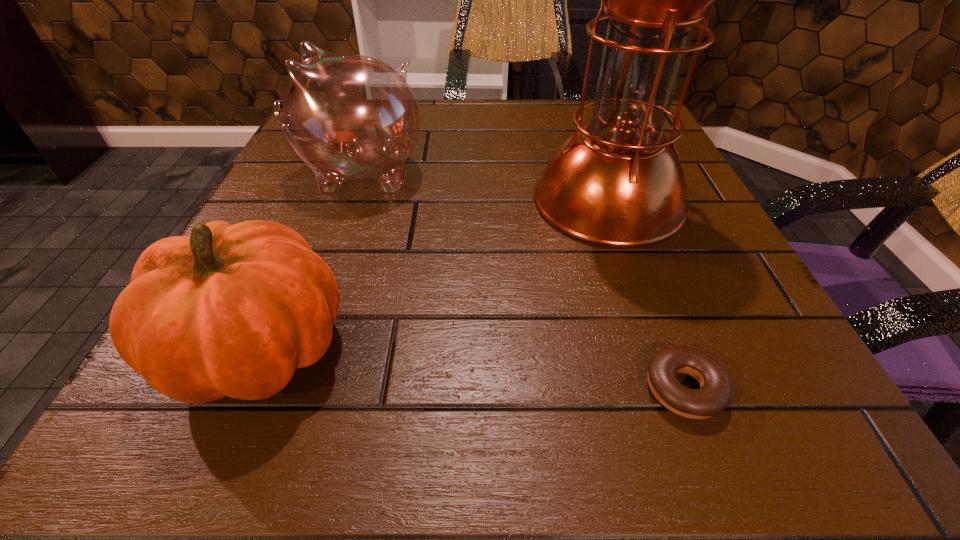
At what (x,y) coordinates should I click in order to perform the action: click on vacant point located between the shortest object and the pumpkin. Please return your answer as a coordinate pair (x, y). Image resolution: width=960 pixels, height=540 pixels. Looking at the image, I should click on pos(471,368).

Select which object appears as the closest to the oil lamp. Please provide its 2D coordinates. Your answer should be formatted as a tuple, i.e. [(x, y)], where the tuple contains the x and y coordinates of a point satisfying the conditions above.

[(714, 395)]

Select which object appears as the second closest to the pumpkin. Please provide its 2D coordinates. Your answer should be formatted as a tuple, i.e. [(x, y)], where the tuple contains the x and y coordinates of a point satisfying the conditions above.

[(618, 182)]

Where is `vacant area that satisfies the following two spatial constraints: 1. on the front side of the pumpkin; 2. on the left side of the doughnut`? The image size is (960, 540). vacant area that satisfies the following two spatial constraints: 1. on the front side of the pumpkin; 2. on the left side of the doughnut is located at coordinates (241, 389).

This screenshot has width=960, height=540. What are the coordinates of `free space in the image that satisfies the following two spatial constraints: 1. on the front facing side of the piggy bank; 2. on the front side of the pumpkin` in the screenshot? It's located at (298, 347).

Locate an element on the screen. This screenshot has height=540, width=960. free region that satisfies the following two spatial constraints: 1. on the front side of the pumpkin; 2. on the right side of the shortest object is located at coordinates tap(241, 389).

You are a GUI agent. You are given a task and a screenshot of the screen. Output one action in this format:
    pyautogui.click(x=<x>, y=<y>)
    Task: Click on the blank space that satisfies the following two spatial constraints: 1. on the front side of the pumpkin; 2. on the right side of the shortest object
    The height and width of the screenshot is (540, 960).
    Given the screenshot: What is the action you would take?
    pyautogui.click(x=241, y=389)

The width and height of the screenshot is (960, 540). What are the coordinates of `blank space that satisfies the following two spatial constraints: 1. on the back side of the pumpkin; 2. on the left side of the oil lamp` in the screenshot? It's located at (323, 200).

The height and width of the screenshot is (540, 960). I want to click on free location that satisfies the following two spatial constraints: 1. on the front facing side of the shortest object; 2. on the right side of the piggy bank, so click(x=282, y=389).

This screenshot has height=540, width=960. Identify the location of blank space that satisfies the following two spatial constraints: 1. on the front facing side of the piggy bank; 2. on the back side of the tallest object. (350, 200).